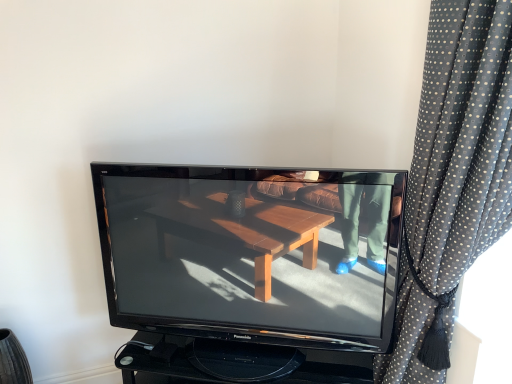
Question: Is black glossy television at center at the left side of black dotted fabric at right?

Choices:
 (A) yes
 (B) no

Answer: (A)

Question: Is there a large distance between black glossy television at center and black dotted fabric at right?

Choices:
 (A) no
 (B) yes

Answer: (A)

Question: Is the position of black glossy television at center less distant than that of black dotted fabric at right?

Choices:
 (A) no
 (B) yes

Answer: (A)

Question: Does black glossy television at center have a lesser height compared to black dotted fabric at right?

Choices:
 (A) yes
 (B) no

Answer: (A)

Question: Is black glossy television at center oriented away from black dotted fabric at right?

Choices:
 (A) yes
 (B) no

Answer: (B)

Question: Is black glossy television at center to the right of black dotted fabric at right from the viewer's perspective?

Choices:
 (A) yes
 (B) no

Answer: (B)

Question: Does black dotted fabric at right have a lesser height compared to black glossy television at center?

Choices:
 (A) yes
 (B) no

Answer: (B)

Question: Is black glossy television at center surrounded by black dotted fabric at right?

Choices:
 (A) yes
 (B) no

Answer: (B)

Question: Could you tell me if black dotted fabric at right is facing black glossy television at center?

Choices:
 (A) yes
 (B) no

Answer: (B)

Question: Is the position of black dotted fabric at right more distant than that of black glossy television at center?

Choices:
 (A) yes
 (B) no

Answer: (B)

Question: Can you confirm if black dotted fabric at right is smaller than black glossy television at center?

Choices:
 (A) yes
 (B) no

Answer: (B)

Question: Is black dotted fabric at right touching black glossy television at center?

Choices:
 (A) yes
 (B) no

Answer: (B)

Question: Which is correct: black glossy television at center is inside black dotted fabric at right, or outside of it?

Choices:
 (A) inside
 (B) outside

Answer: (B)